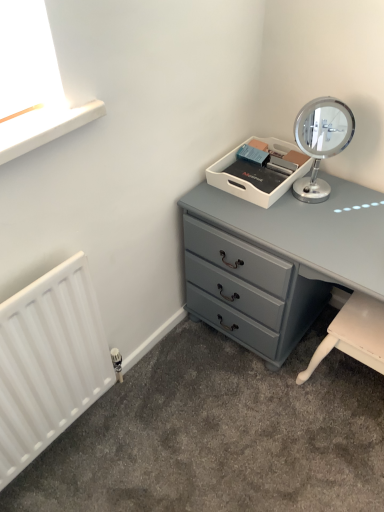
At what (x,y) coordinates should I click in order to perform the action: click on vacant space underneath polished chrome mirror at upper right (from a real-world perspective). Please return your answer as a coordinate pair (x, y). The width and height of the screenshot is (384, 512). Looking at the image, I should click on (314, 198).